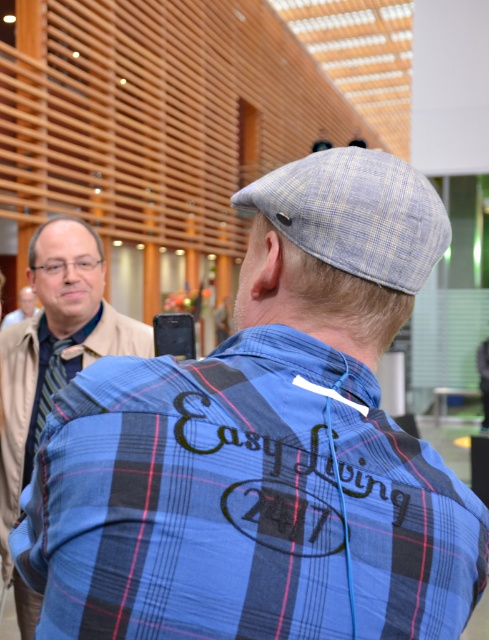
Does matte black shirt at upper left have a lesser height compared to striped fabric tie at left?

No, matte black shirt at upper left is not shorter than striped fabric tie at left.

Does matte black shirt at upper left have a larger size compared to striped fabric tie at left?

Yes, matte black shirt at upper left is bigger than striped fabric tie at left.

Locate an element on the screen. The height and width of the screenshot is (640, 489). matte black shirt at upper left is located at coordinates (52, 362).

Is matte black shirt at upper left below matte black jacket at left?

Yes.

Which of these two, matte black shirt at upper left or matte black jacket at left, stands shorter?

matte black jacket at left

Who is more distant from viewer, (0,547) or (27,312)?

Point (27,312)

Identify the location of matte black shirt at upper left. (52, 362).

Is blue plaid shirt at center positioned at the back of matte black jacket at left?

That is False.

Is the position of blue plaid shirt at center less distant than that of matte black jacket at left?

That is True.

Which is behind, point (306, 472) or point (18, 308)?

Point (18, 308)

Find the location of a particular element. This screenshot has height=640, width=489. blue plaid shirt at center is located at coordinates (243, 504).